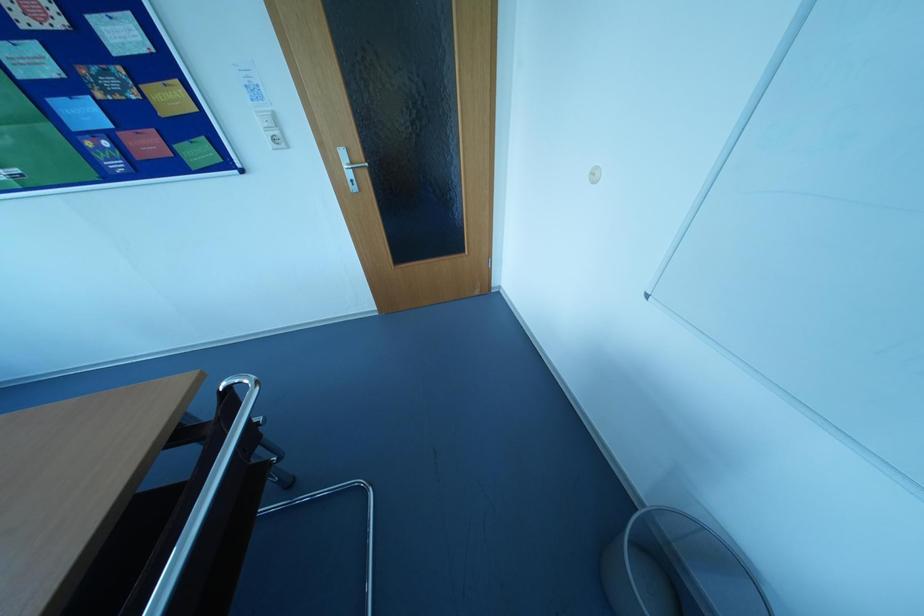
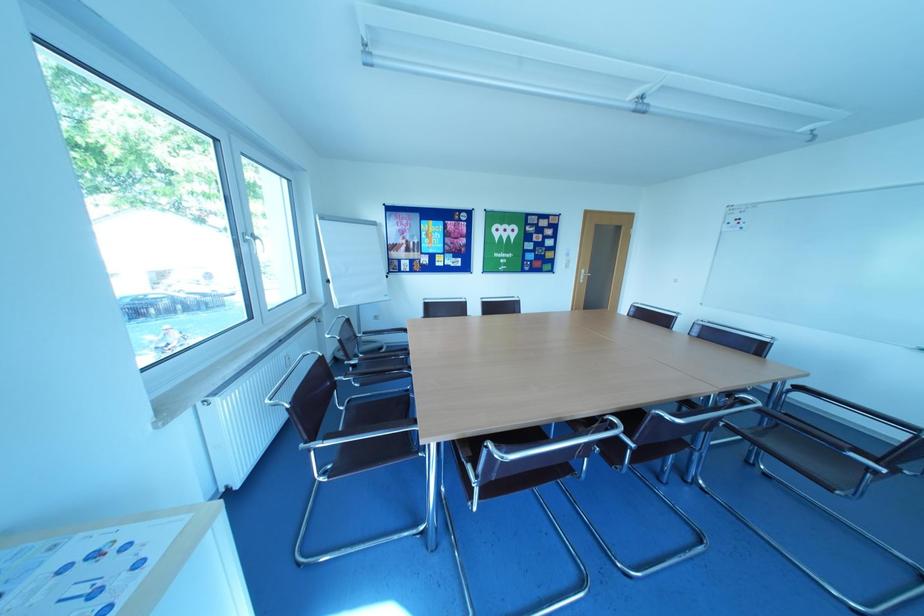
What movement of the cameraman would produce the second image?

The movement direction of the cameraman is left, backward.